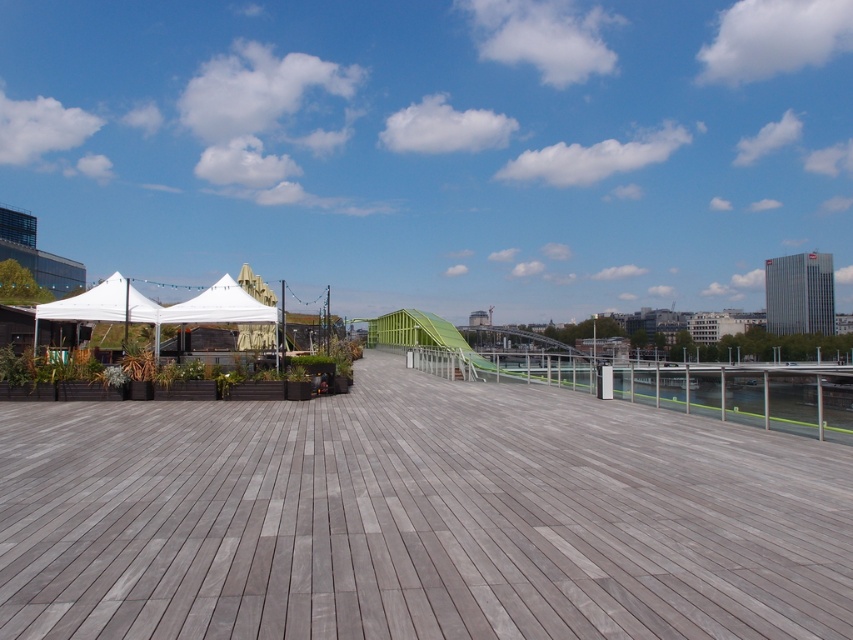
Question: Which object appears closest to the camera in this image?

Choices:
 (A) gray wood deck at center
 (B) green plastic slide at center
 (C) dark green wooden planter at left

Answer: (A)

Question: Can you confirm if dark green wooden planter at left is bigger than green plastic slide at center?

Choices:
 (A) no
 (B) yes

Answer: (A)

Question: Which object is the farthest from the gray wood deck at center?

Choices:
 (A) green plastic slide at center
 (B) dark green wooden planter at left

Answer: (A)

Question: Which object is positioned closest to the green plastic slide at center?

Choices:
 (A) gray wood deck at center
 (B) dark green wooden planter at left

Answer: (A)

Question: Can you confirm if gray wood deck at center is bigger than green plastic slide at center?

Choices:
 (A) yes
 (B) no

Answer: (B)

Question: Does gray wood deck at center come in front of green plastic slide at center?

Choices:
 (A) no
 (B) yes

Answer: (B)